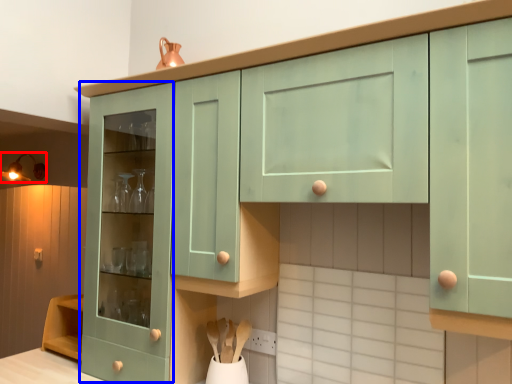
Question: Which object is further to the camera taking this photo, light fixture (highlighted by a red box) or cabinetry (highlighted by a blue box)?

Choices:
 (A) light fixture
 (B) cabinetry

Answer: (A)